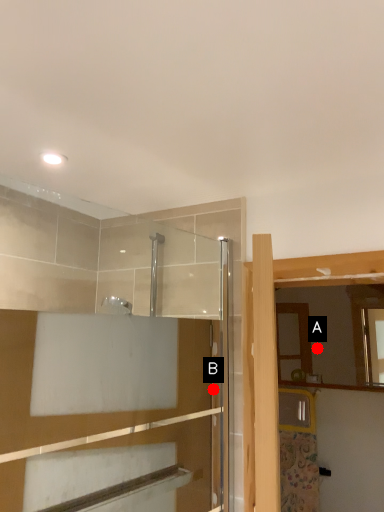
Question: Two points are circled on the image, labeled by A and B beside each circle. Which point appears farthest from the camera in this image?

Choices:
 (A) A is further
 (B) B is further

Answer: (A)